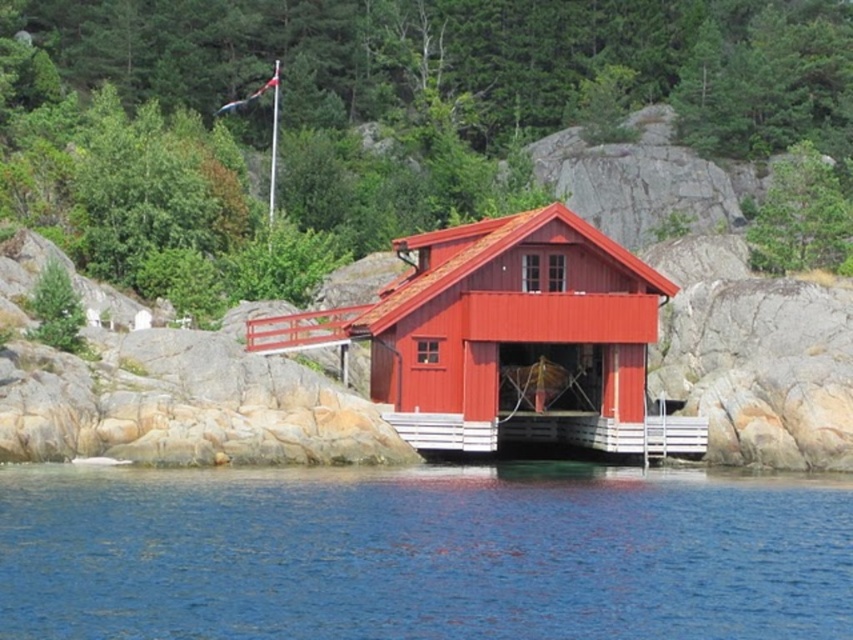
Question: Observing the image, what is the correct spatial positioning of blue water at lower center in reference to matte red cabin at center?

Choices:
 (A) above
 (B) below

Answer: (B)

Question: Among these points, which one is nearest to the camera?

Choices:
 (A) (419, 236)
 (B) (167, 508)

Answer: (B)

Question: Which object is closer to the camera taking this photo?

Choices:
 (A) white wooden dock at center
 (B) matte red cabin at center
 (C) blue water at lower center

Answer: (C)

Question: Estimate the real-world distances between objects in this image. Which object is closer to the matte red cabin at center?

Choices:
 (A) blue water at lower center
 (B) white wooden dock at center

Answer: (B)

Question: Considering the relative positions of blue water at lower center and matte red cabin at center in the image provided, where is blue water at lower center located with respect to matte red cabin at center?

Choices:
 (A) below
 (B) above

Answer: (A)

Question: Does blue water at lower center have a greater width compared to matte red cabin at center?

Choices:
 (A) yes
 (B) no

Answer: (A)